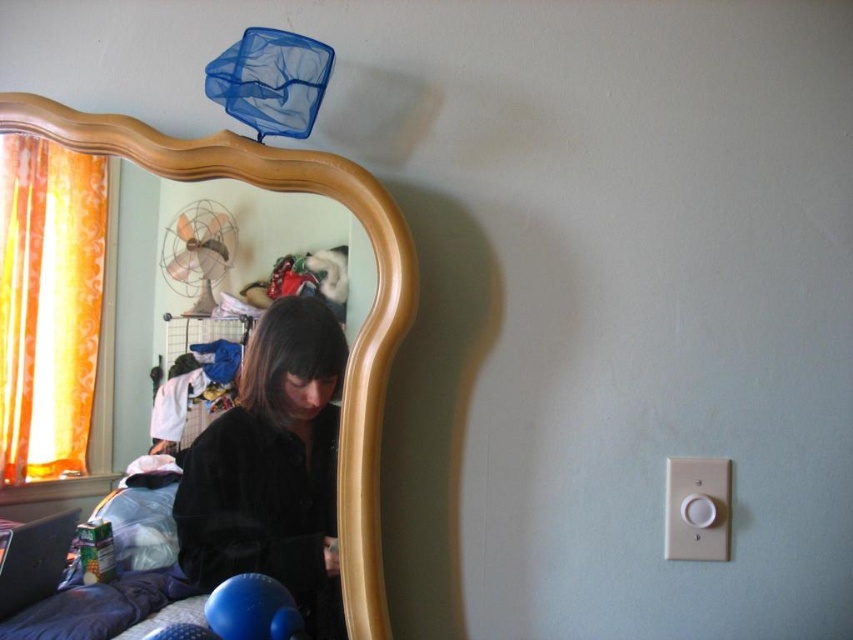
Which is more to the left, wooden mirror at left or black plastic laptop at lower left?

Positioned to the left is black plastic laptop at lower left.

Does point (345, 598) come farther from viewer compared to point (26, 600)?

Yes, it is.

The width and height of the screenshot is (853, 640). Identify the location of wooden mirror at left. (358, 330).

Is point (263, 339) closer to viewer compared to point (302, 164)?

No, (263, 339) is further to viewer.

Who is more distant from viewer, (x=337, y=412) or (x=370, y=413)?

Positioned behind is point (x=337, y=412).

In order to click on black velvet coat at center in this screenshot , I will do `click(271, 468)`.

Between black velvet coat at center and black plastic laptop at lower left, which one has less height?

black plastic laptop at lower left is shorter.

Which is below, black velvet coat at center or black plastic laptop at lower left?

black plastic laptop at lower left

Measure the distance between point (x=308, y=419) and camera.

They are 27.78 inches apart.

You are a GUI agent. You are given a task and a screenshot of the screen. Output one action in this format:
    pyautogui.click(x=<x>, y=<y>)
    Task: Click on the black velvet coat at center
    The height and width of the screenshot is (640, 853).
    Given the screenshot: What is the action you would take?
    pyautogui.click(x=271, y=468)